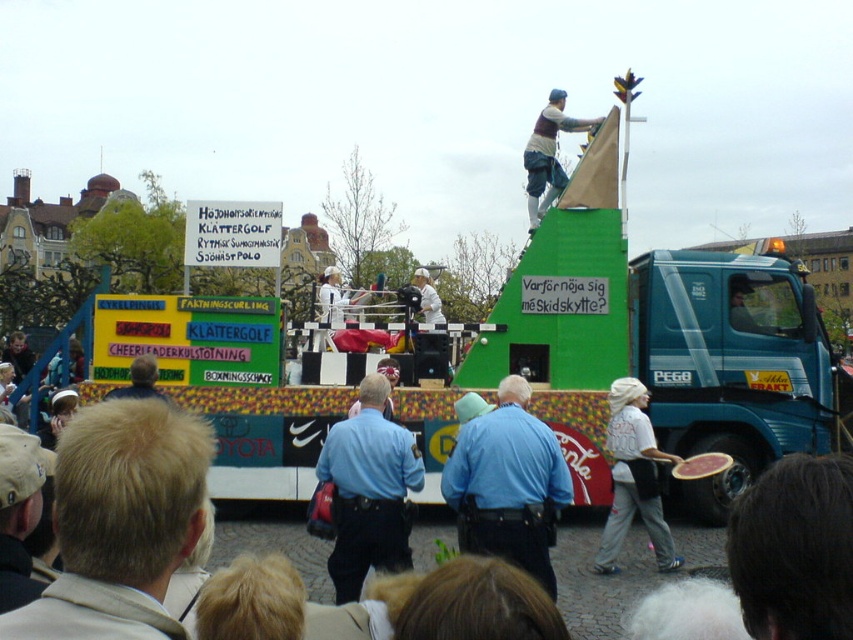
Question: Which is farther from the blue uniform shirt at center?

Choices:
 (A) blonde hair at center
 (B) blue uniform at center
 (C) matte brown vest at upper center

Answer: (C)

Question: Is blonde hair at center to the right of light brown hair at lower left from the viewer's perspective?

Choices:
 (A) yes
 (B) no

Answer: (A)

Question: Which point is closer to the camera?

Choices:
 (A) (552, 588)
 (B) (112, 435)
 (C) (390, 481)
 (D) (534, 225)

Answer: (B)

Question: Does blue uniform shirt at center have a smaller size compared to light brown hair at lower left?

Choices:
 (A) yes
 (B) no

Answer: (A)

Question: Which object is closer to the camera taking this photo?

Choices:
 (A) blonde hair at center
 (B) blue uniform at center
 (C) light brown hair at lower left
 (D) blue uniform shirt at center

Answer: (A)

Question: Does matte brown vest at upper center lie in front of light brown hair at lower left?

Choices:
 (A) yes
 (B) no

Answer: (B)